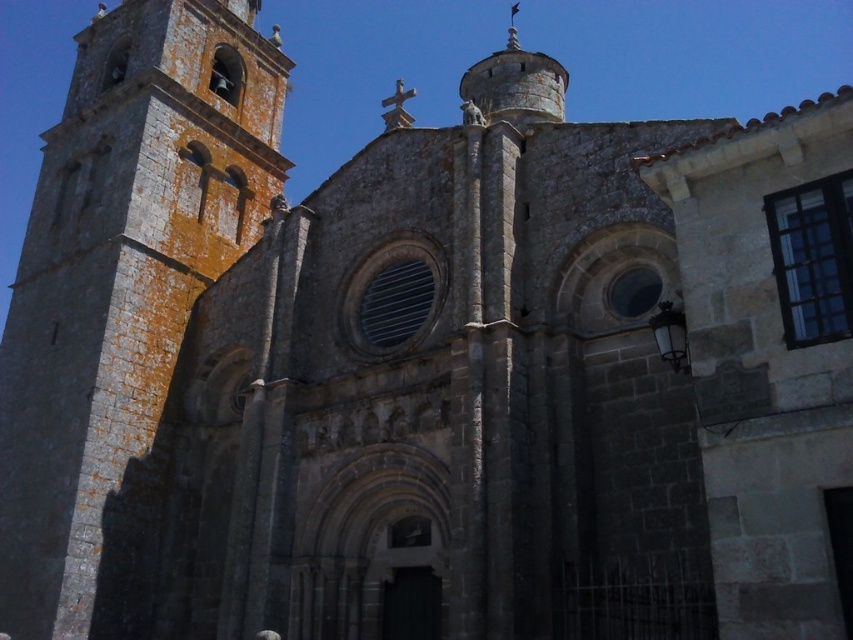
Question: Observing the image, what is the correct spatial positioning of greenish stone tower at left in reference to smooth stone spire at upper center?

Choices:
 (A) below
 (B) above

Answer: (A)

Question: Which point is closer to the camera?

Choices:
 (A) greenish stone tower at left
 (B) smooth stone spire at upper center

Answer: (A)

Question: Observing the image, what is the correct spatial positioning of greenish stone tower at left in reference to smooth stone spire at upper center?

Choices:
 (A) right
 (B) left

Answer: (B)

Question: Among these points, which one is nearest to the camera?

Choices:
 (A) (473, 83)
 (B) (132, 225)

Answer: (B)

Question: Is greenish stone tower at left positioned behind smooth stone spire at upper center?

Choices:
 (A) yes
 (B) no

Answer: (B)